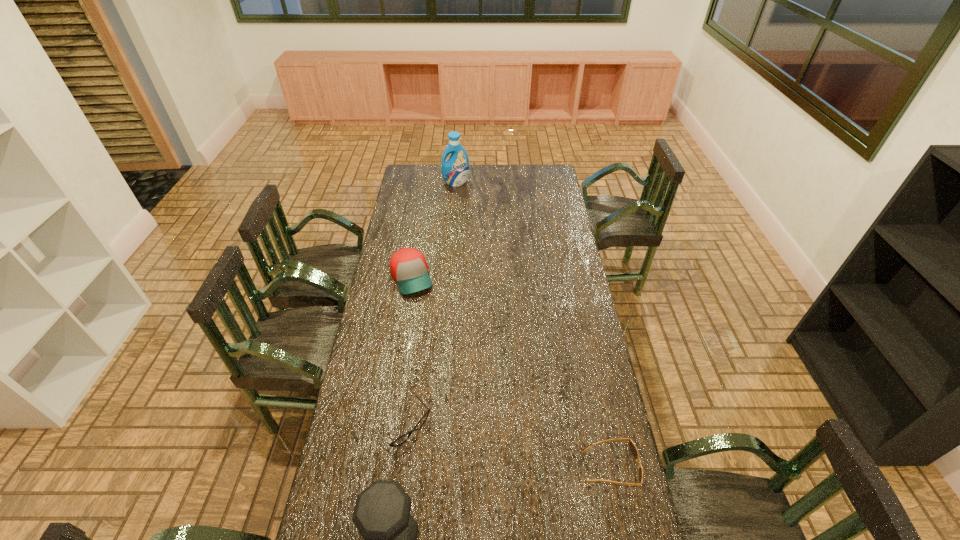
This screenshot has height=540, width=960. In order to click on empty space between the rightmost object and the third shortest object in this screenshot , I will do `click(511, 373)`.

The height and width of the screenshot is (540, 960). Find the location of `free space that is in between the rightmost object and the fourth tallest object`. free space that is in between the rightmost object and the fourth tallest object is located at coordinates (507, 447).

Locate an element on the screen. object that can be found as the third closest to the second shortest object is located at coordinates (408, 266).

Identify which object is the closest to the fourth shortest object. Please provide its 2D coordinates. Your answer should be formatted as a tuple, i.e. [(x, y)], where the tuple contains the x and y coordinates of a point satisfying the conditions above.

[(403, 438)]